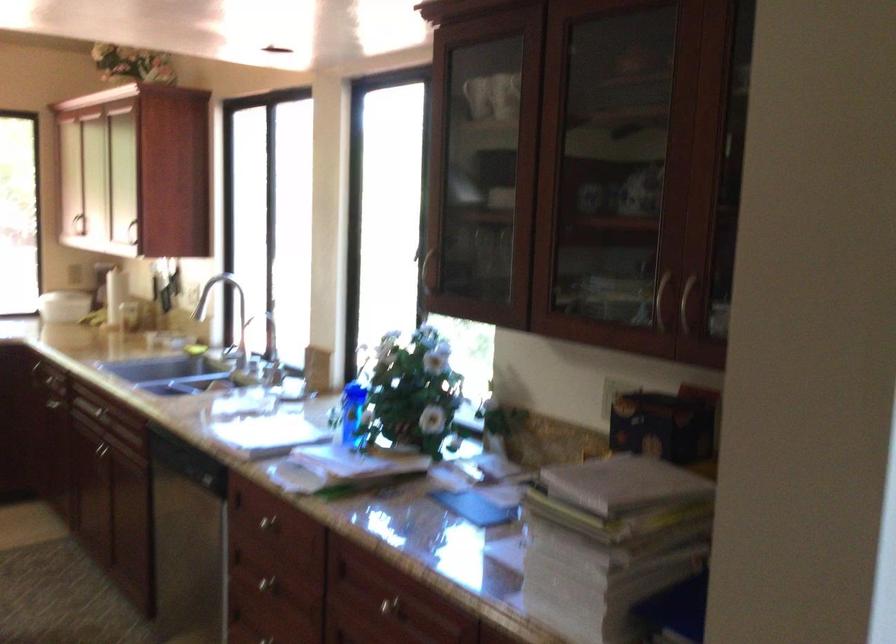
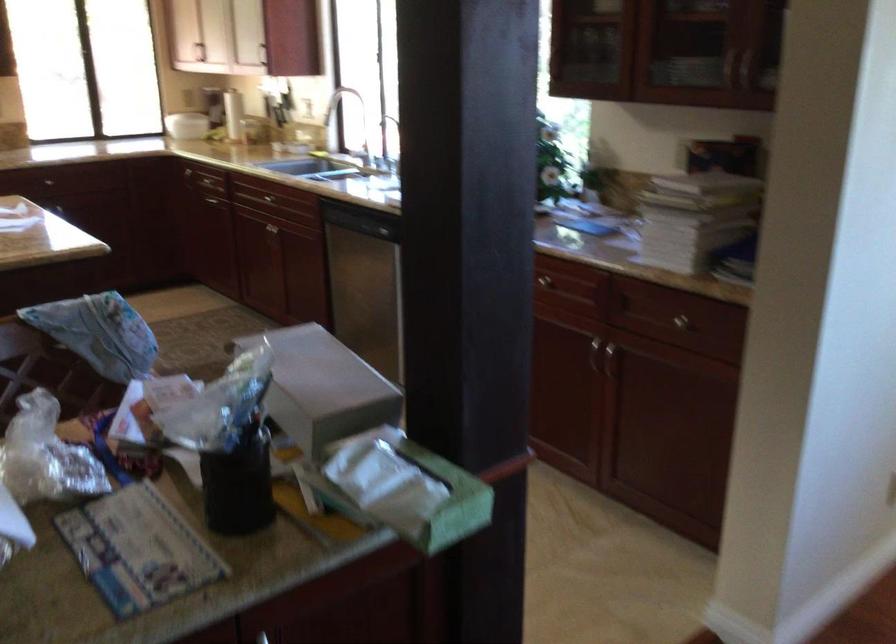
Question: I am providing you with two images of the same scene from different viewpoints. Please identify which objects are invisible in image2.

Choices:
 (A) faucet handle
 (B) silver cabinet handle
 (C) dishwasher handle
 (D) red spigot handle

Answer: (B)